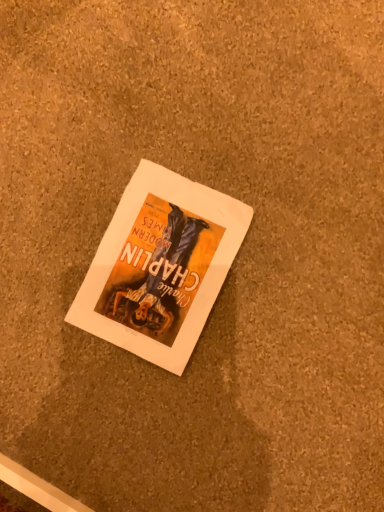
Locate an element on the screen. blank space above matte paper book at center (from a real-world perspective) is located at coordinates (161, 256).